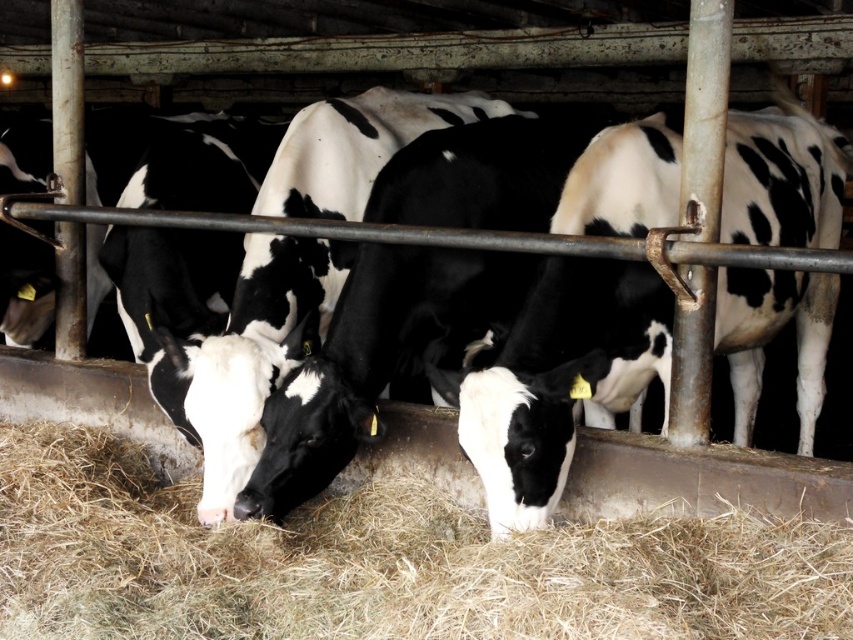
Is brown dry hay at center shorter than black and white cow at center?

Yes, brown dry hay at center is shorter than black and white cow at center.

Can you confirm if brown dry hay at center is bigger than black and white cow at center?

Actually, brown dry hay at center might be smaller than black and white cow at center.

Describe the element at coordinates (379, 563) in the screenshot. I see `brown dry hay at center` at that location.

What are the coordinates of `brown dry hay at center` in the screenshot? It's located at (379, 563).